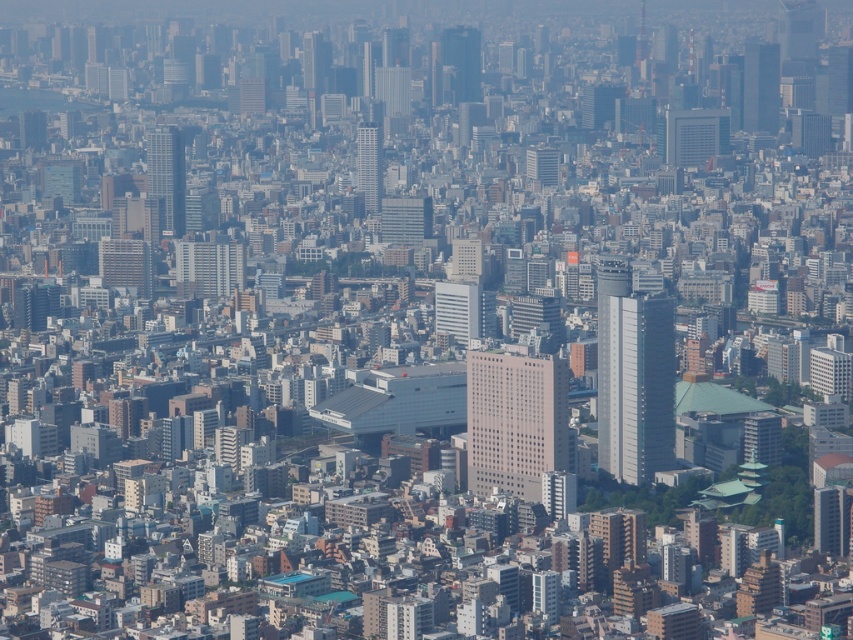
Does beige concrete building at center appear on the right side of smooth glass skyscraper at center?

Yes, beige concrete building at center is to the right of smooth glass skyscraper at center.

Is the position of beige concrete building at center more distant than that of smooth glass skyscraper at center?

No, it is in front of smooth glass skyscraper at center.

From the picture: Who is more forward, (512, 413) or (380, 192)?

Point (380, 192) is more forward.

Where is `beige concrete building at center`? The image size is (853, 640). beige concrete building at center is located at coordinates (515, 420).

Can you confirm if beige concrete building at center is wider than smooth glass skyscraper at upper center?

Indeed, beige concrete building at center has a greater width compared to smooth glass skyscraper at upper center.

What do you see at coordinates (515, 420) in the screenshot?
I see `beige concrete building at center` at bounding box center [515, 420].

Which is in front, point (555, 374) or point (474, 58)?

Point (555, 374)

Find the location of `beige concrete building at center`. beige concrete building at center is located at coordinates [515, 420].

Which is behind, point (753, 52) or point (477, 54)?

Point (753, 52)

Is smooth glass skyscraper at upper right taller than smooth glass skyscraper at upper center?

Correct, smooth glass skyscraper at upper right is much taller as smooth glass skyscraper at upper center.

Find the location of a particular element. Image resolution: width=853 pixels, height=640 pixels. smooth glass skyscraper at upper right is located at coordinates (759, 88).

I want to click on smooth glass skyscraper at upper right, so click(x=759, y=88).